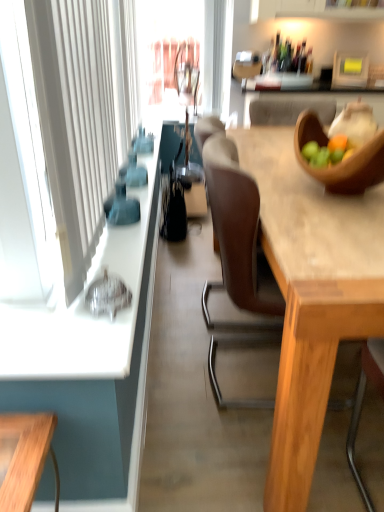
Question: Is white fabric curtain at left far from black leather handbag at center?

Choices:
 (A) no
 (B) yes

Answer: (B)

Question: Can you confirm if white fabric curtain at left is bigger than black leather handbag at center?

Choices:
 (A) no
 (B) yes

Answer: (B)

Question: From a real-world perspective, is white fabric curtain at left under black leather handbag at center?

Choices:
 (A) no
 (B) yes

Answer: (A)

Question: Does white fabric curtain at left appear on the left side of black leather handbag at center?

Choices:
 (A) yes
 (B) no

Answer: (A)

Question: Can you confirm if white fabric curtain at left is positioned to the right of black leather handbag at center?

Choices:
 (A) no
 (B) yes

Answer: (A)

Question: Which is correct: wooden bowl at upper right is inside white fabric curtain at left, or outside of it?

Choices:
 (A) inside
 (B) outside

Answer: (B)

Question: From the image's perspective, is wooden bowl at upper right above or below white fabric curtain at left?

Choices:
 (A) below
 (B) above

Answer: (A)

Question: In the image, is wooden bowl at upper right positioned in front of or behind white fabric curtain at left?

Choices:
 (A) behind
 (B) front

Answer: (A)

Question: Looking at their shapes, would you say wooden bowl at upper right is wider or thinner than white fabric curtain at left?

Choices:
 (A) thin
 (B) wide

Answer: (B)

Question: In terms of height, does wooden table at center look taller or shorter compared to white fabric curtain at left?

Choices:
 (A) tall
 (B) short

Answer: (B)

Question: Considering the relative positions of wooden table at center and white fabric curtain at left in the image provided, is wooden table at center to the left or to the right of white fabric curtain at left?

Choices:
 (A) right
 (B) left

Answer: (A)

Question: From a real-world perspective, is wooden table at center physically located above or below white fabric curtain at left?

Choices:
 (A) above
 (B) below

Answer: (B)

Question: Looking at the image, does wooden table at center seem bigger or smaller compared to white fabric curtain at left?

Choices:
 (A) small
 (B) big

Answer: (B)

Question: From a real-world perspective, relative to wooden bowl at upper right, is white fabric curtain at left vertically above or below?

Choices:
 (A) above
 (B) below

Answer: (A)

Question: Relative to wooden bowl at upper right, is white fabric curtain at left in front or behind?

Choices:
 (A) behind
 (B) front

Answer: (B)